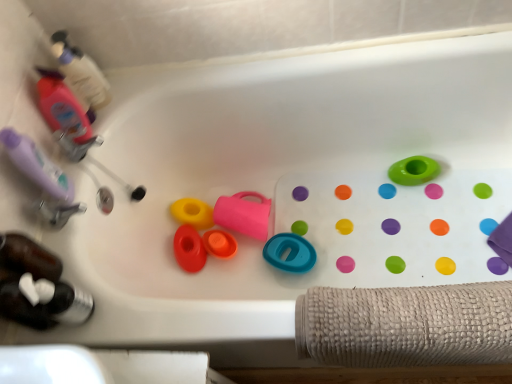
Question: From a real-world perspective, is orange matte cup at center, which is the fourth toy in right-to-left order, above or below translucent pink bottle at upper left, acting as the second bottle starting from the bottom?

Choices:
 (A) below
 (B) above

Answer: (A)

Question: From the image's perspective, is orange matte cup at center, which appears as the third toy when viewed from the left, located above or below translucent pink bottle at upper left, acting as the second bottle starting from the bottom?

Choices:
 (A) below
 (B) above

Answer: (A)

Question: Which of these objects is positioned closest to the translucent pink bottle at upper left, the second bottle in the top-to-bottom sequence?

Choices:
 (A) translucent plastic bottle at upper left, placed as the 3th bottle when sorted from bottom to top
 (B) rubberized orange bath plug at center, the 6th toy viewed from the right
 (C) purple matte bottle at left
 (D) translucent plastic bottle at lower left, marked as the first bottle in a bottom-to-top arrangement
 (E) green rubber ring at upper right, positioned as the sixth toy in left-to-right order

Answer: (A)

Question: Which object is the farthest from the yellow rubber toy at center, the second toy positioned from the left?

Choices:
 (A) teal rubber ring at center, which is the fifth toy in left-to-right order
 (B) rubberized orange bath plug at center, the 6th toy viewed from the right
 (C) translucent pink bottle at upper left, acting as the second bottle starting from the bottom
 (D) orange matte cup at center, which appears as the third toy when viewed from the left
 (E) pink rubber cup at center, which ranks as the third toy in right-to-left order

Answer: (C)